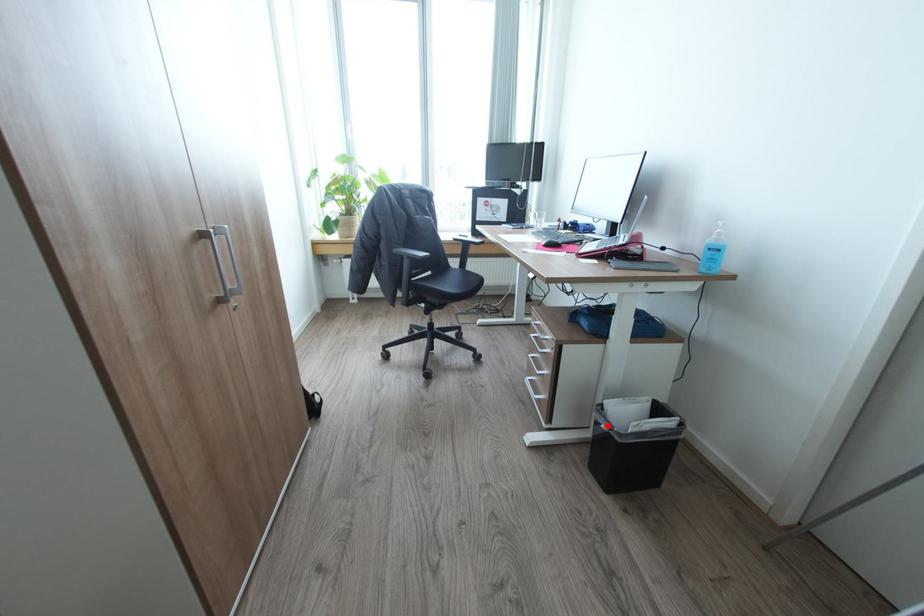
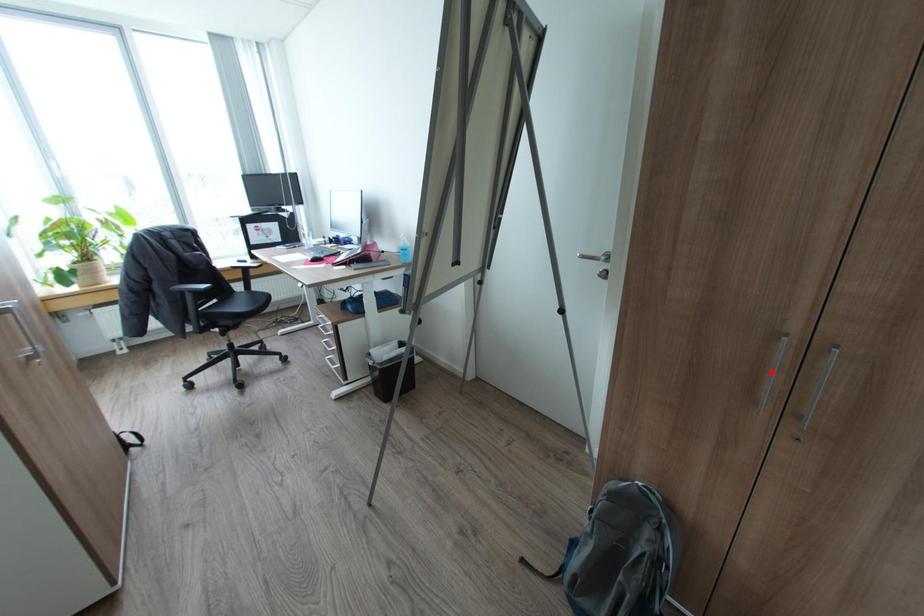
I am providing you with two images of the same scene from different viewpoints. A red point is marked on the first image and another point is marked on the second image. Do the highlighted points in image1 and image2 indicate the same real-world spot?

No